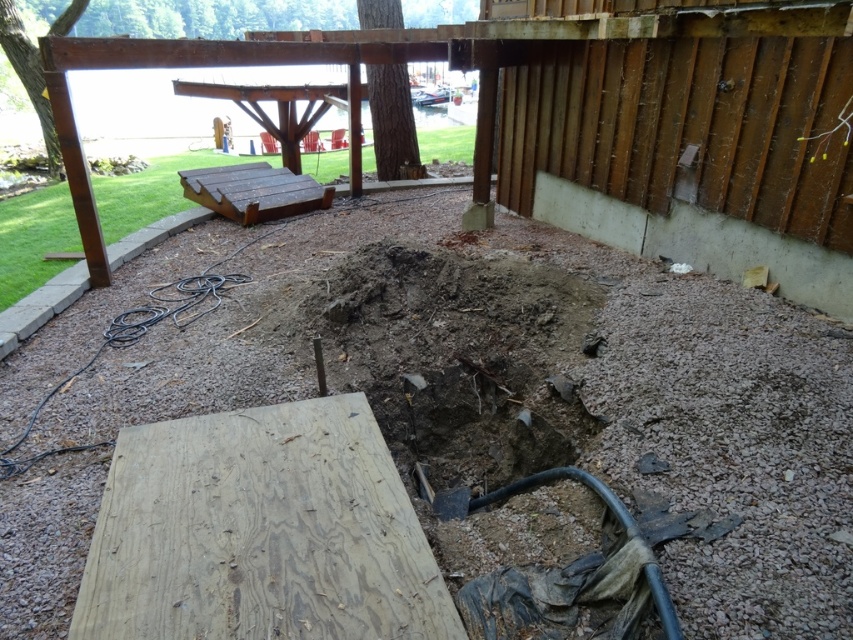
Is the position of gray concrete foundation at right less distant than that of brown wooden picnic table at upper left?

That is True.

Does gray concrete foundation at right have a greater width compared to brown wooden picnic table at upper left?

No, gray concrete foundation at right is not wider than brown wooden picnic table at upper left.

Where is `gray concrete foundation at right`? The height and width of the screenshot is (640, 853). gray concrete foundation at right is located at coordinates (700, 243).

Is point (189, 177) closer to viewer compared to point (183, 212)?

Yes, point (189, 177) is in front of point (183, 212).

Can you confirm if brown wooden picnic table at upper left is thinner than black rubber hose at lower left?

In fact, brown wooden picnic table at upper left might be wider than black rubber hose at lower left.

Find the location of a particular element. The height and width of the screenshot is (640, 853). brown wooden picnic table at upper left is located at coordinates (254, 192).

Can you confirm if gray concrete foundation at right is smaller than black rubber hose at lower left?

No, gray concrete foundation at right is not smaller than black rubber hose at lower left.

Image resolution: width=853 pixels, height=640 pixels. Find the location of `gray concrete foundation at right`. gray concrete foundation at right is located at coordinates (700, 243).

Locate an element on the screen. gray concrete foundation at right is located at coordinates (700, 243).